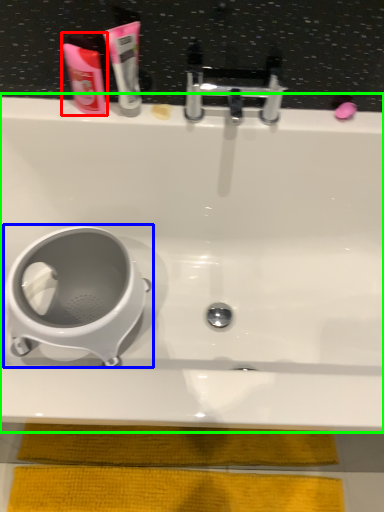
Question: Considering the real-world distances, which object is closest to mouthwash (highlighted by a red box)? toilet (highlighted by a blue box) or bathtub (highlighted by a green box).

Choices:
 (A) toilet
 (B) bathtub

Answer: (B)